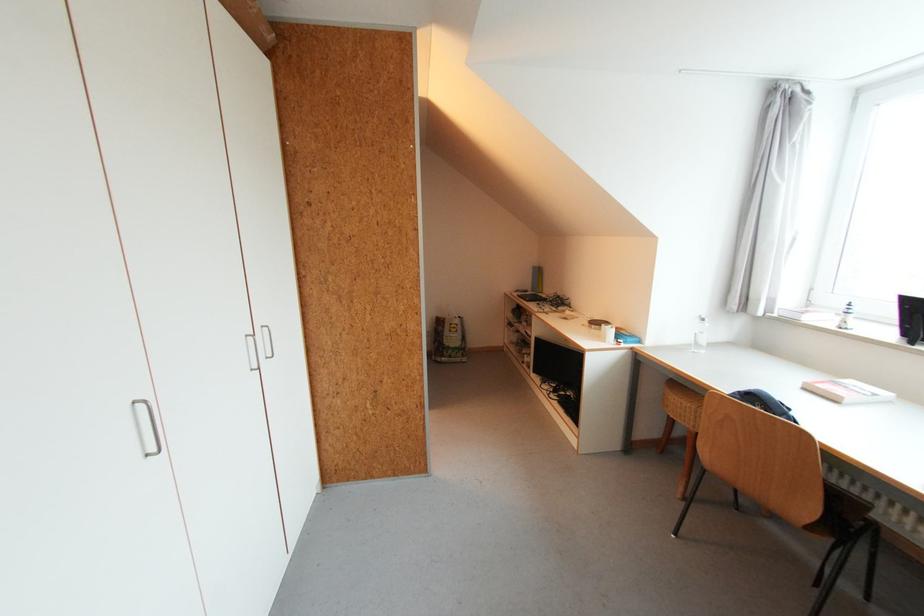
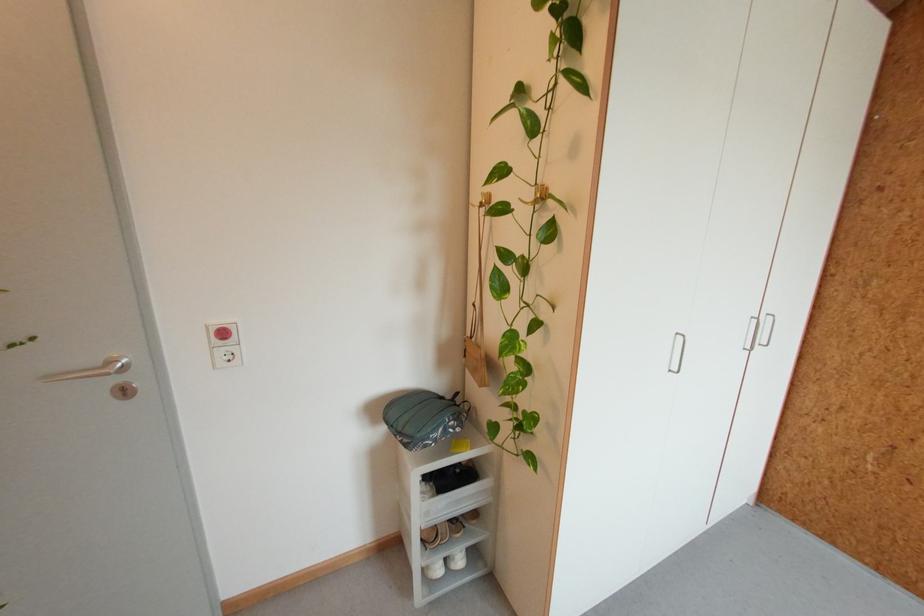
Find the pixel in the second image that matches point (251, 336) in the first image.

(758, 318)